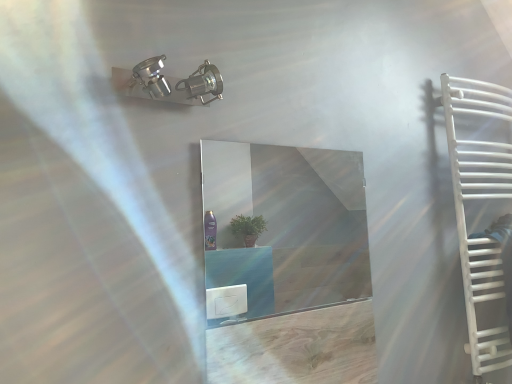
Question: Does white plastic stairs at right come behind clear glass mirror at center?

Choices:
 (A) yes
 (B) no

Answer: (A)

Question: Is white plastic stairs at right taller than clear glass mirror at center?

Choices:
 (A) yes
 (B) no

Answer: (B)

Question: From the image's perspective, does white plastic stairs at right appear higher than clear glass mirror at center?

Choices:
 (A) yes
 (B) no

Answer: (B)

Question: Is clear glass mirror at center completely or partially inside white plastic stairs at right?

Choices:
 (A) yes
 (B) no

Answer: (B)

Question: Is white plastic stairs at right positioned beyond the bounds of clear glass mirror at center?

Choices:
 (A) yes
 (B) no

Answer: (A)

Question: Does white plastic stairs at right have a smaller size compared to clear glass mirror at center?

Choices:
 (A) yes
 (B) no

Answer: (B)

Question: Can you confirm if clear glass mirror at center is thinner than white plastic stairs at right?

Choices:
 (A) no
 (B) yes

Answer: (B)

Question: From the image's perspective, is clear glass mirror at center above white plastic stairs at right?

Choices:
 (A) no
 (B) yes

Answer: (B)

Question: Could you tell me if clear glass mirror at center is turned towards white plastic stairs at right?

Choices:
 (A) yes
 (B) no

Answer: (B)

Question: Is clear glass mirror at center far from white plastic stairs at right?

Choices:
 (A) no
 (B) yes

Answer: (B)

Question: Is clear glass mirror at center at the left side of white plastic stairs at right?

Choices:
 (A) no
 (B) yes

Answer: (B)

Question: Is clear glass mirror at center oriented away from white plastic stairs at right?

Choices:
 (A) no
 (B) yes

Answer: (A)

Question: Is white plastic stairs at right positioned with its back to white matte towel rack at right?

Choices:
 (A) yes
 (B) no

Answer: (A)